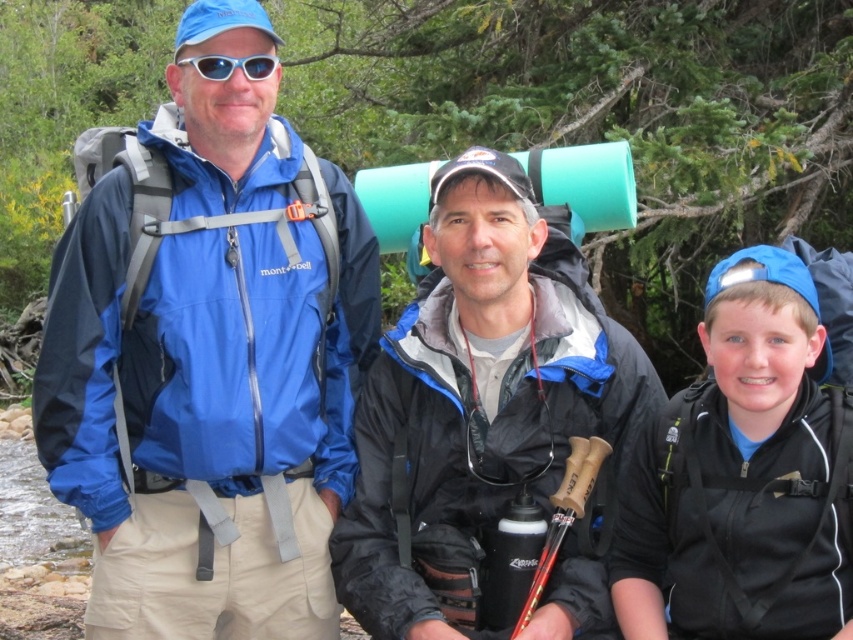
You are a photographer trying to capture a candid shot of the blue fabric jacket at center without the subject noticing. The camera is 13.16 feet away. Is the distance sufficient to avoid detection?

The blue fabric jacket at center and camera are 13.16 feet apart from each other, so the distance is sufficient to avoid detection as the subject is unlikely to notice the photographer at that range.

You are a photographer trying to capture a group photo of the hikers. You want to ensure the blue fabric jacket at center and the matte black jacket at center are both in the frame. Based on their positions, which jacket should you focus on first to include both in the shot?

The blue fabric jacket at center is to the left of the matte black jacket at center, so you should focus on the matte black jacket at center first to include both in the shot.

You are a photographer trying to capture the matte black jacket at center and the white plastic goggles at upper center in the same frame. Can you see both objects clearly in the photo without moving the camera?

The matte black jacket at center is in front of the white plastic goggles at upper center, so the goggles might be partially or fully obscured in the photo.